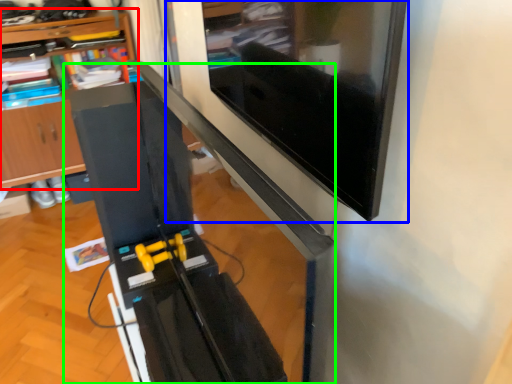
Question: Which object is positioned farthest from shelf (highlighted by a red box)? Select from computer monitor (highlighted by a blue box) and computer desk (highlighted by a green box).

Choices:
 (A) computer monitor
 (B) computer desk

Answer: (A)